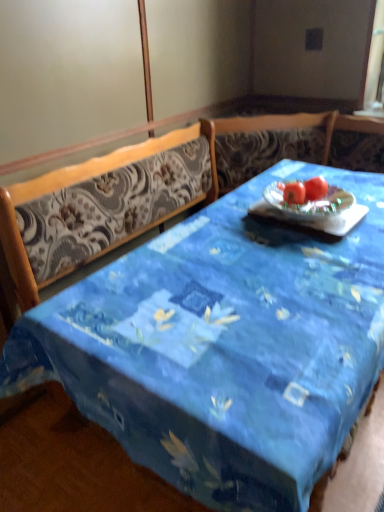
Question: Choose the correct answer: Is red matte tomato at center inside red matte tomato at center or outside it?

Choices:
 (A) inside
 (B) outside

Answer: (B)

Question: From a real-world perspective, is red matte tomato at center above or below red matte tomato at center?

Choices:
 (A) above
 (B) below

Answer: (B)

Question: Which is nearer to the blue fabric table at center?

Choices:
 (A) red matte tomato at center
 (B) red matte tomato at center

Answer: (A)

Question: Estimate the real-world distances between objects in this image. Which object is farther from the blue fabric table at center?

Choices:
 (A) red matte tomato at center
 (B) red matte tomato at center

Answer: (A)